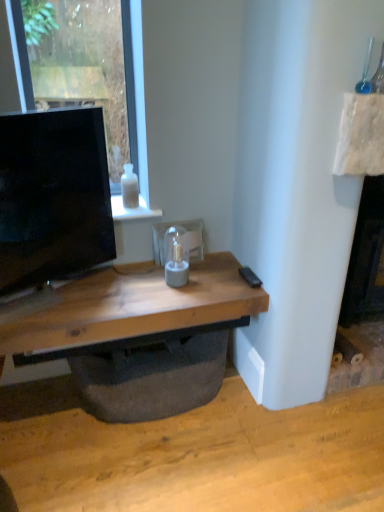
Where is `free region under matte black tv at left (from a real-world perspective)`? This screenshot has width=384, height=512. free region under matte black tv at left (from a real-world perspective) is located at coordinates (49, 295).